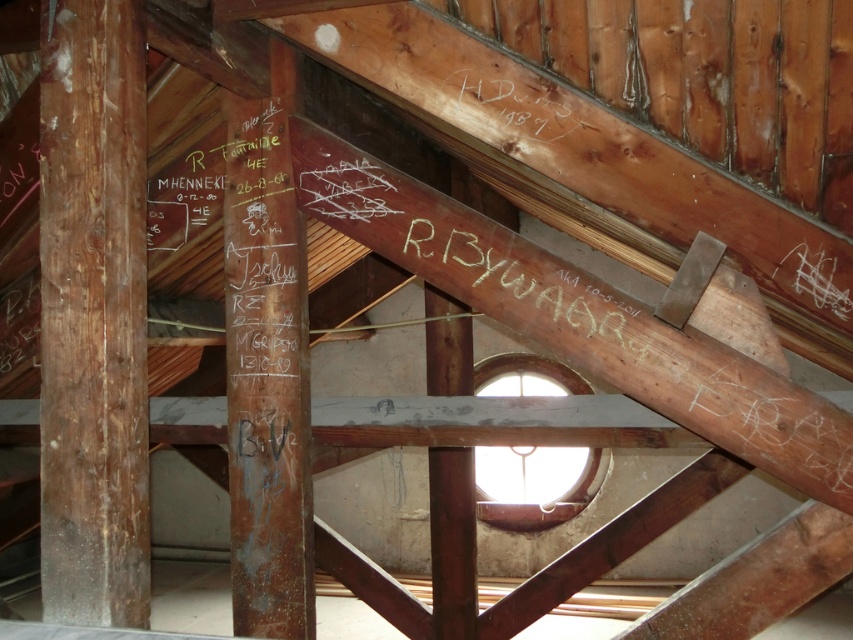
You are standing in the attic and want to move from the brown wood pillar at left to the transparent glass window at center. Which direction should you move to get closer to the window?

Since the brown wood pillar at left is closer to the viewer than the transparent glass window at center, you should move forward away from the pillar towards the window to get closer to it.

In the scene shown: You are an interior designer planning to install a new light fixture in this attic. You have two options for placement locations. The first option is near the brown wood pillar at left, and the second option is near the black wood writing at upper center. Based on their sizes, which location would provide more space around the fixture?

The brown wood pillar at left has a larger size compared to the black wood writing at upper center, so placing the light fixture near the black wood writing at upper center would leave more space around it.

You are an architect designing a new lighting system for the loft. You have a spotlight that can project light up to 12 feet. You need to place it so it can illuminate both the brown wood pillar at center and the transparent glass window at center. Can the spotlight reach both objects from the same position?

The distance between the brown wood pillar at center and the transparent glass window at center is 13.37 feet. Since the spotlight can only reach up to 12 feet, it cannot illuminate both objects from the same position as the distance exceeds its maximum range.